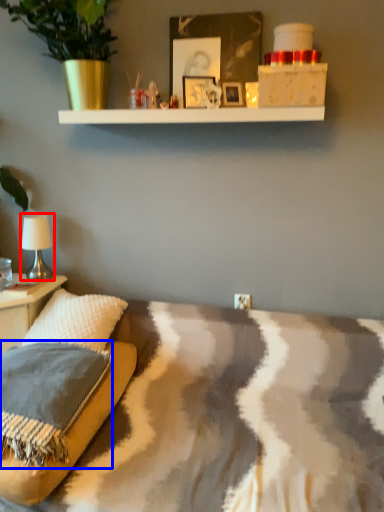
Question: Which of the following is the farthest to the observer, table lamp (highlighted by a red box) or pillow (highlighted by a blue box)?

Choices:
 (A) table lamp
 (B) pillow

Answer: (A)